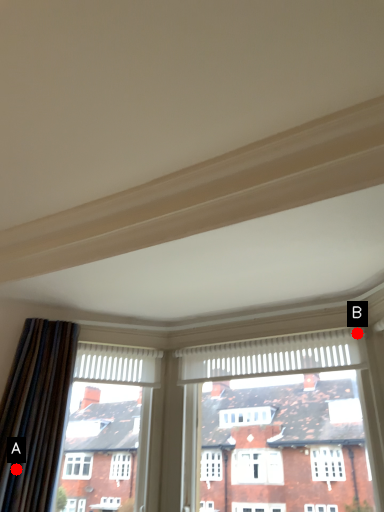
Question: Two points are circled on the image, labeled by A and B beside each circle. Which point appears closest to the camera in this image?

Choices:
 (A) A is closer
 (B) B is closer

Answer: (A)